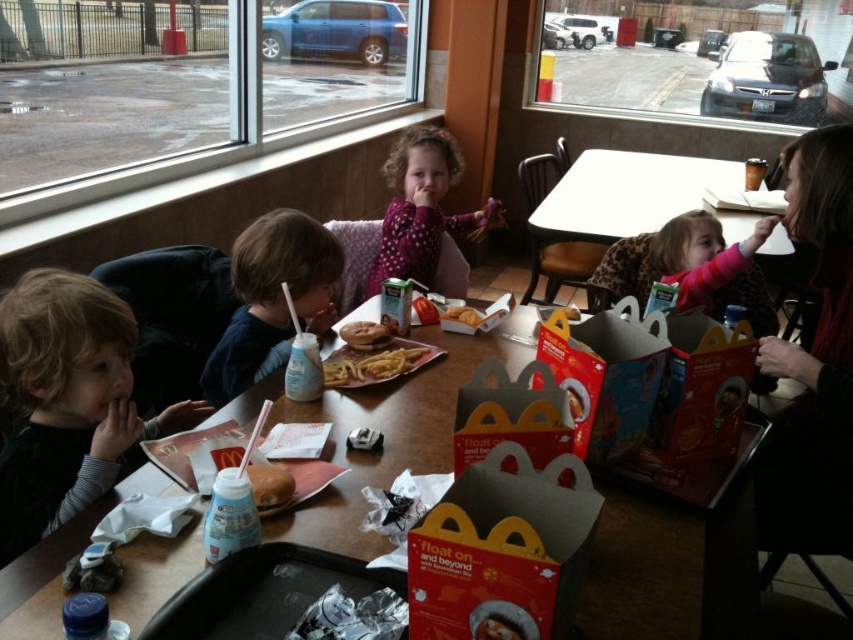
Measure the distance between golden crispy french fries at center and camera.

golden crispy french fries at center and camera are 5.26 feet apart from each other.

Is golden crispy french fries at center thinner than golden crispy chicken at center?

No, golden crispy french fries at center is not thinner than golden crispy chicken at center.

The height and width of the screenshot is (640, 853). Describe the element at coordinates (364, 333) in the screenshot. I see `golden crispy french fries at center` at that location.

The image size is (853, 640). I want to click on golden crispy french fries at center, so click(x=364, y=333).

Is yellow crispy french fries at center closer to the viewer compared to golden crispy chicken at center?

Yes, yellow crispy french fries at center is closer to the viewer.

Can you confirm if yellow crispy french fries at center is shorter than golden crispy chicken at center?

Incorrect, yellow crispy french fries at center's height does not fall short of golden crispy chicken at center's.

Does point (422, 346) lie behind point (457, 305)?

That is False.

The height and width of the screenshot is (640, 853). In order to click on yellow crispy french fries at center in this screenshot , I will do `click(372, 365)`.

Who is lower down, white plastic table at upper center or golden crispy chicken at center?

golden crispy chicken at center is below.

Which is behind, point (573, 221) or point (474, 321)?

Point (573, 221)

Identify the location of white plastic table at upper center. (636, 195).